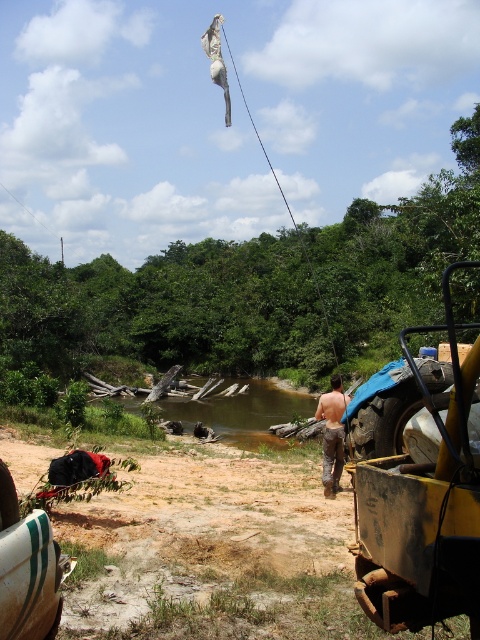
Question: Which of the following is the farthest from the observer?

Choices:
 (A) brown/canvas pants at center
 (B) yellow metallic tractor at right

Answer: (A)

Question: Which of the following is the farthest from the observer?

Choices:
 (A) brown/canvas pants at center
 (B) yellow metallic tractor at right

Answer: (A)

Question: In this image, where is yellow metallic tractor at right located relative to brown/canvas pants at center?

Choices:
 (A) above
 (B) below

Answer: (A)

Question: Is yellow metallic tractor at right smaller than brown/canvas pants at center?

Choices:
 (A) yes
 (B) no

Answer: (B)

Question: Among these points, which one is nearest to the camera?

Choices:
 (A) (337, 381)
 (B) (432, 401)

Answer: (B)

Question: Is yellow metallic tractor at right to the left of brown/canvas pants at center from the viewer's perspective?

Choices:
 (A) no
 (B) yes

Answer: (A)